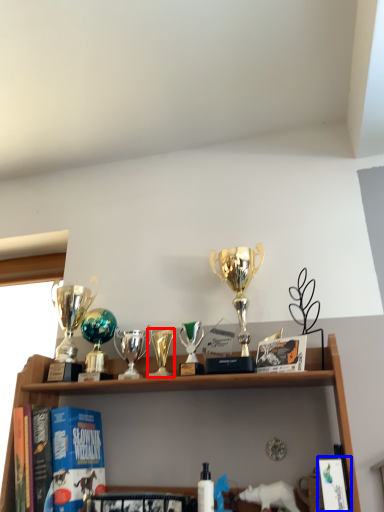
Question: Among these objects, which one is farthest to the camera, candle holder (highlighted by a red box) or book (highlighted by a blue box)?

Choices:
 (A) candle holder
 (B) book

Answer: (A)